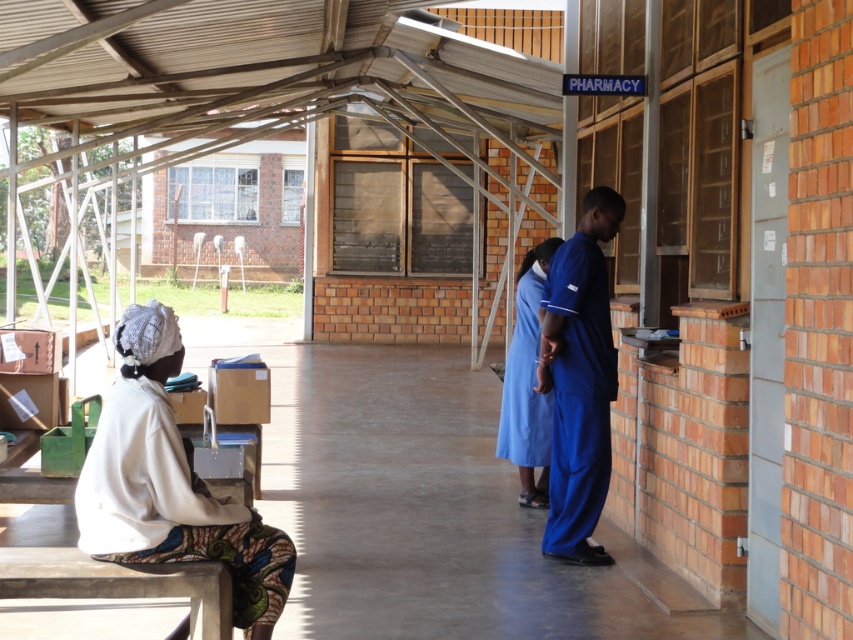
Which is above, white fabric at left or blue fabric pants at right?

blue fabric pants at right is higher up.

At what (x,y) coordinates should I click in order to perform the action: click on white fabric at left. Please return your answer as a coordinate pair (x, y). This screenshot has width=853, height=640. Looking at the image, I should click on (170, 483).

Is point (248, 602) less distant than point (601, 236)?

That is True.

Locate an element on the screen. This screenshot has width=853, height=640. white fabric at left is located at coordinates (170, 483).

Is white fabric at left to the left of blue fabric dress at center from the viewer's perspective?

Indeed, white fabric at left is positioned on the left side of blue fabric dress at center.

What do you see at coordinates (170, 483) in the screenshot? I see `white fabric at left` at bounding box center [170, 483].

Which is behind, point (132, 552) or point (531, 273)?

The point (531, 273) is more distant.

Find the location of a particular element. white fabric at left is located at coordinates (170, 483).

Is point (585, 387) positioned after point (535, 330)?

No, it is not.

Is blue fabric pants at right wider than blue fabric dress at center?

Yes, blue fabric pants at right is wider than blue fabric dress at center.

The width and height of the screenshot is (853, 640). What do you see at coordinates (579, 380) in the screenshot?
I see `blue fabric pants at right` at bounding box center [579, 380].

I want to click on blue fabric pants at right, so click(579, 380).